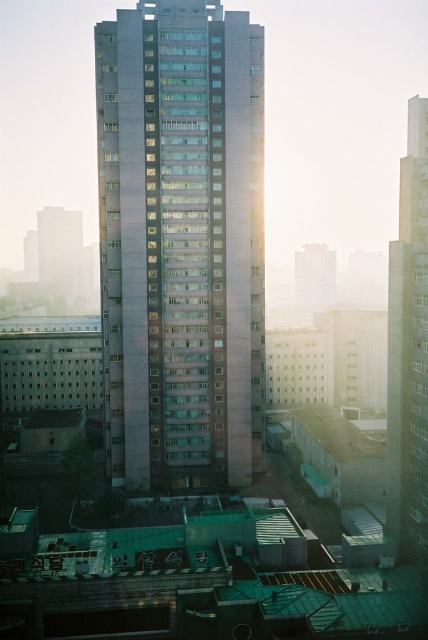
Question: Is smooth gray building at center above metallic glass skyscraper at right?

Choices:
 (A) no
 (B) yes

Answer: (A)

Question: Does smooth gray building at center appear over metallic glass skyscraper at right?

Choices:
 (A) yes
 (B) no

Answer: (B)

Question: Among these points, which one is farthest from the camera?

Choices:
 (A) (419, 371)
 (B) (115, 364)

Answer: (B)

Question: Can you confirm if smooth gray building at center is positioned below metallic glass skyscraper at right?

Choices:
 (A) yes
 (B) no

Answer: (A)

Question: Which point is closer to the camera taking this photo?

Choices:
 (A) (404, 499)
 (B) (231, 352)

Answer: (A)